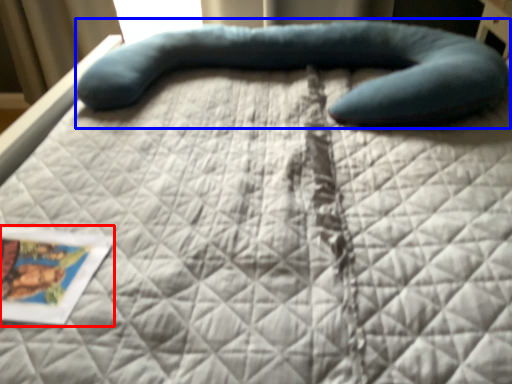
Question: Which of the following is the farthest to the observer, postcard (highlighted by a red box) or bean bag chair (highlighted by a blue box)?

Choices:
 (A) postcard
 (B) bean bag chair

Answer: (B)